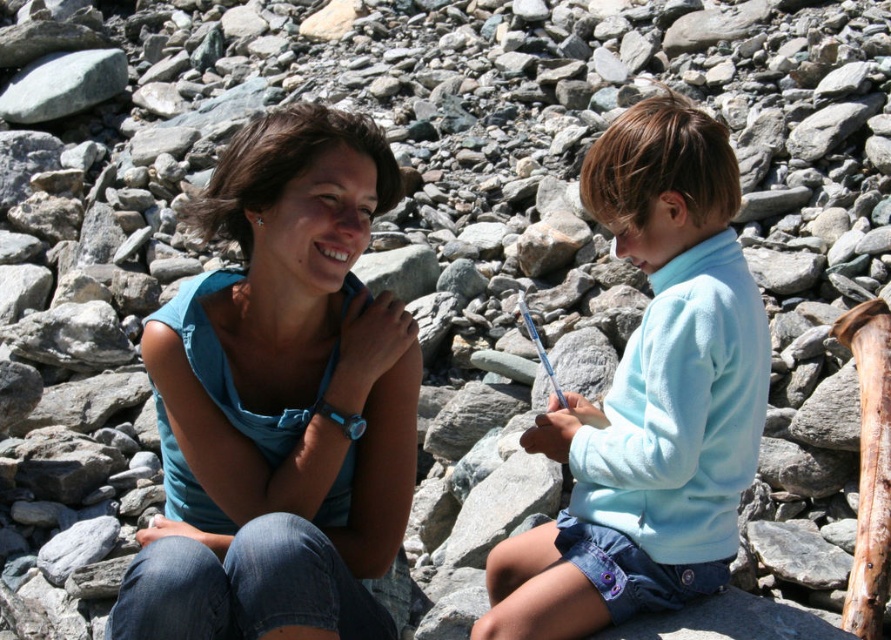
You are a photographer planning to take a portrait of the two people in the scene. You want to ensure that both the blue denim jeans at center and the light blue fleece at center are clearly visible in the photo. Based on their positions, which clothing item will appear lower in the frame?

The blue denim jeans at center will appear lower in the frame because it is positioned below the light blue fleece at center.

You are a photographer trying to capture a candid shot of both the blue denim jeans at center and the light blue fleece at center. Since you want to ensure both are fully visible in the frame, which object should you focus on first to avoid cropping either?

The blue denim jeans at center has a greater height compared to the light blue fleece at center, so you should focus on framing the blue denim jeans at center first to ensure its full visibility, as it is taller and might require more space in the composition.

You are a photographer standing 2 meters away from the blue denim jeans at center and light blue fleece at center. You want to take a photo that includes both items in the frame. Given your camera has a maximum zoom range of 1.5 meters, can you capture both items without moving closer?

The distance between the blue denim jeans at center and the light blue fleece at center is 1.21 meters. Since your camera can zoom up to 1.5 meters, you can capture both items in the frame without moving closer.